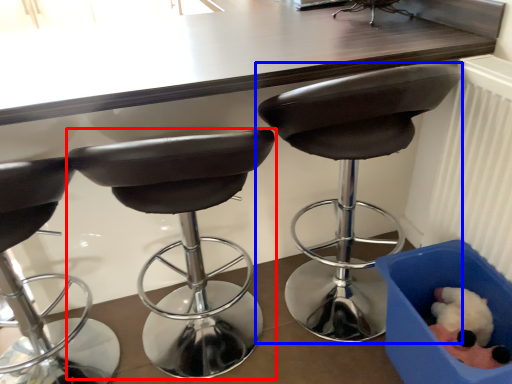
Question: Which of the following is the closest to the observer, chair (highlighted by a red box) or chair (highlighted by a blue box)?

Choices:
 (A) chair
 (B) chair

Answer: (A)